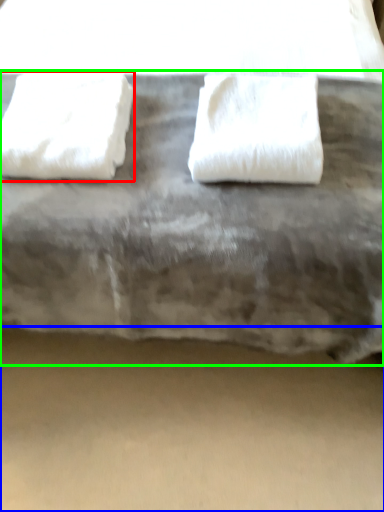
Question: Which object is the closest to the towel (highlighted by a red box)? Choose among these: concrete (highlighted by a blue box) or furniture (highlighted by a green box).

Choices:
 (A) concrete
 (B) furniture

Answer: (B)